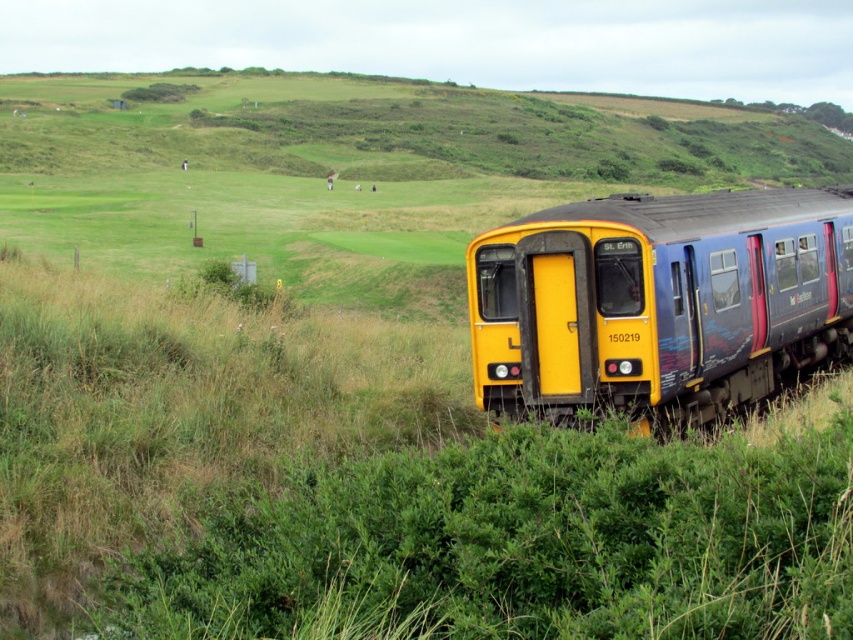
You are a photographer standing in the field. You want to take a photo that includes both the yellow matte train at center and the green grassy hillside at upper center. Which object should be placed in the foreground of your photo?

The yellow matte train at center should be placed in the foreground because it is closer to the viewer than the green grassy hillside at upper center.

You are standing at the camera position and want to take a photo of the yellow matte train at center. The camera has a maximum focus range of 40 feet. Will the train be in focus?

The yellow matte train at center is 41.83 feet from the camera, which exceeds the maximum focus range of 40 feet. Therefore, the train will not be in focus.

You are a photographer trying to capture the yellow matte train at center and the green grassy hillside at upper center in a single shot. Which object should you focus on first if you want the larger one to be in sharp focus?

The green grassy hillside at upper center is larger than the yellow matte train at center, so you should focus on the green grassy hillside at upper center first to ensure it is in sharp focus.